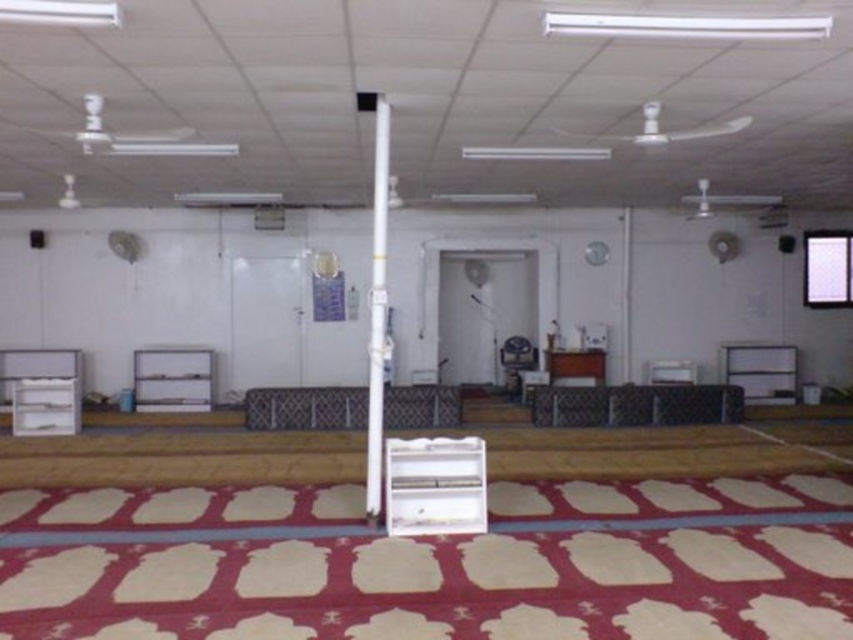
In the scene shown: Who is shorter, metallic chain-link fence at center or white glossy pole at center?

metallic chain-link fence at center is shorter.

This screenshot has height=640, width=853. I want to click on metallic chain-link fence at center, so click(x=636, y=404).

Find the location of `metallic chain-link fence at center`. metallic chain-link fence at center is located at coordinates (x=636, y=404).

Is point (379, 100) positioned behind point (535, 362)?

No, it is not.

Is white glossy pole at center closer to the viewer compared to metallic silver chair at center?

Yes, white glossy pole at center is closer to the viewer.

Who is more distant from viewer, (376, 100) or (531, 352)?

The point (531, 352) is more distant.

At what (x,y) coordinates should I click in order to perform the action: click on white glossy pole at center. Please return your answer as a coordinate pair (x, y). Image resolution: width=853 pixels, height=640 pixels. Looking at the image, I should click on (376, 308).

Does metallic silver bench at center have a larger size compared to white glossy pole at center?

Yes.

Can you confirm if metallic silver bench at center is positioned to the left of white glossy pole at center?

Yes, metallic silver bench at center is to the left of white glossy pole at center.

Locate an element on the screen. The width and height of the screenshot is (853, 640). metallic silver bench at center is located at coordinates (306, 406).